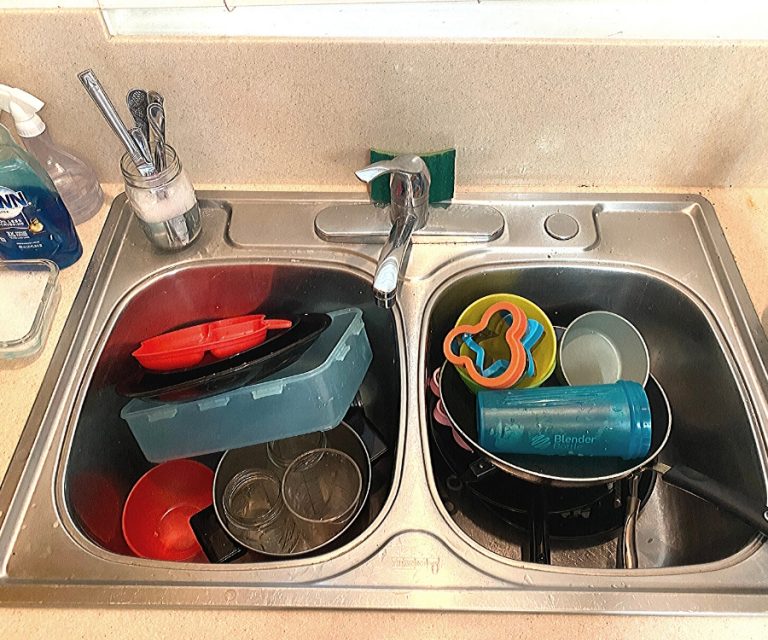
In order to click on dirty dishes in left side of sink in this screenshot , I will do `click(220, 416)`, `click(232, 479)`.